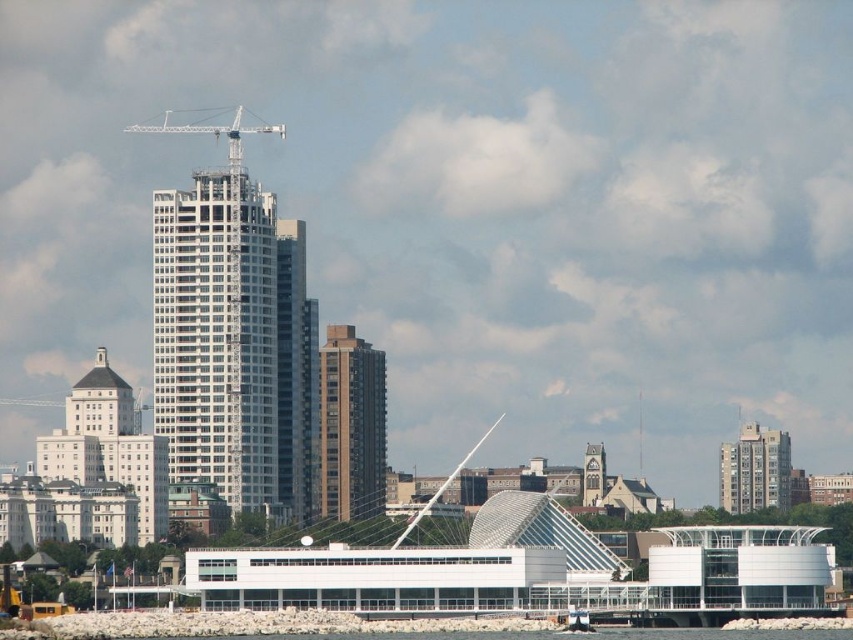
Question: Where is white smooth building at left located in relation to brown brick building at center in the image?

Choices:
 (A) above
 (B) below

Answer: (B)

Question: Among these objects, which one is nearest to the camera?

Choices:
 (A) gray concrete building at right
 (B) brown brick building at center

Answer: (B)

Question: Among these objects, which one is nearest to the camera?

Choices:
 (A) white glass building at center
 (B) light brown stone church at upper center
 (C) white smooth building at left
 (D) brown brick building at center

Answer: (D)

Question: Does brown brick building at center have a smaller size compared to gray concrete building at right?

Choices:
 (A) no
 (B) yes

Answer: (A)

Question: Based on their relative distances, which object is farther from the brown brick building at center?

Choices:
 (A) white smooth building at left
 (B) white metallic crane at upper center

Answer: (B)

Question: Can you confirm if white metallic crane at upper center is positioned above light brown stone church at upper center?

Choices:
 (A) no
 (B) yes

Answer: (B)